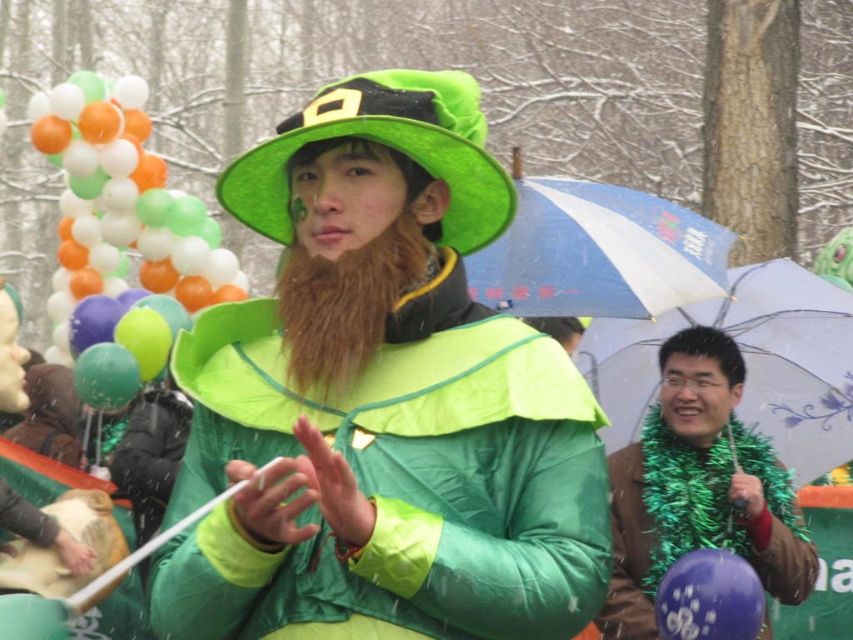
Can you confirm if transparent plastic umbrella at right is positioned above green felt hat at center?

Incorrect, transparent plastic umbrella at right is not positioned above green felt hat at center.

Can you confirm if transparent plastic umbrella at right is bigger than green felt hat at center?

Yes, transparent plastic umbrella at right is bigger than green felt hat at center.

This screenshot has width=853, height=640. Describe the element at coordinates (746, 362) in the screenshot. I see `transparent plastic umbrella at right` at that location.

Where is `transparent plastic umbrella at right`? The height and width of the screenshot is (640, 853). transparent plastic umbrella at right is located at coordinates (746, 362).

Which of these two, transparent plastic umbrella at right or shiny purple balloon at lower right, stands shorter?

shiny purple balloon at lower right

Does transparent plastic umbrella at right appear on the left side of shiny purple balloon at lower right?

No, transparent plastic umbrella at right is not to the left of shiny purple balloon at lower right.

You are a GUI agent. You are given a task and a screenshot of the screen. Output one action in this format:
    pyautogui.click(x=<x>, y=<y>)
    Task: Click on the transparent plastic umbrella at right
    The width and height of the screenshot is (853, 640).
    Given the screenshot: What is the action you would take?
    pyautogui.click(x=746, y=362)

Locate an element on the screen. This screenshot has height=640, width=853. transparent plastic umbrella at right is located at coordinates (746, 362).

Is green matte hat at center above blue printed umbrella at center?

No, green matte hat at center is not above blue printed umbrella at center.

Is point (577, 401) behind point (612, 289)?

No, (577, 401) is in front of (612, 289).

Does point (512, 372) come closer to viewer compared to point (552, 221)?

Yes.

At what (x,y) coordinates should I click in order to perform the action: click on green matte hat at center. Please return your answer as a coordinate pair (x, y). The image size is (853, 640). Looking at the image, I should click on (381, 401).